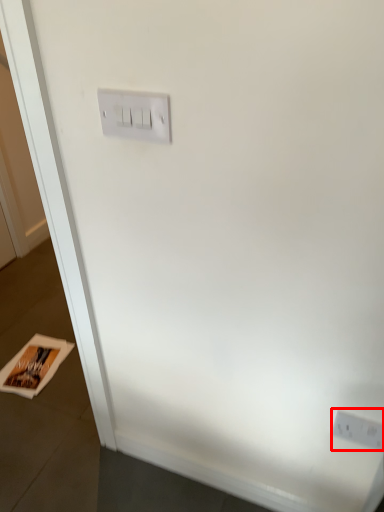
Question: Observing the image, what is the correct spatial positioning of power plugs and sockets (annotated by the red box) in reference to magazine?

Choices:
 (A) left
 (B) right

Answer: (B)